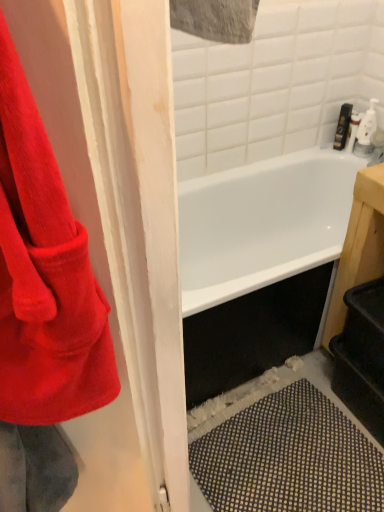
Locate an element on the screen. This screenshot has width=384, height=512. space that is in front of matte black soap dispenser at upper right is located at coordinates (349, 159).